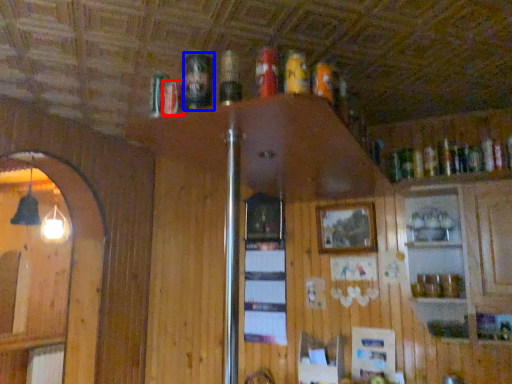
Question: Which of the following is the farthest to the observer, beer (highlighted by a red box) or beer (highlighted by a blue box)?

Choices:
 (A) beer
 (B) beer

Answer: (A)